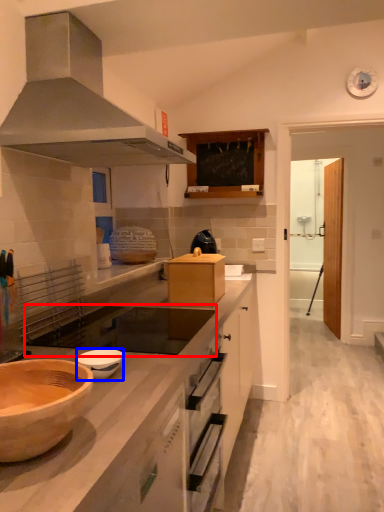
Question: Which point is closer to the camera, gas stove (highlighted by a red box) or bowl (highlighted by a blue box)?

Choices:
 (A) gas stove
 (B) bowl

Answer: (B)